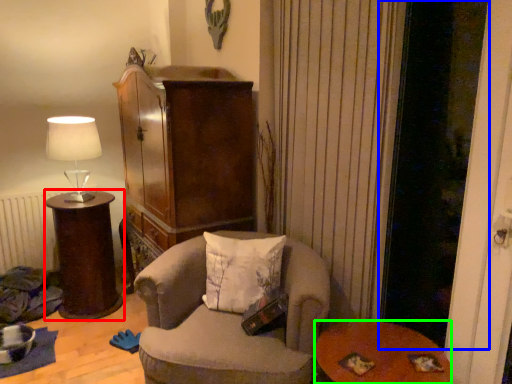
Question: Based on their relative distances, which object is farther from desk (highlighted by a red box)? Choose from screen door (highlighted by a blue box) and table (highlighted by a green box).

Choices:
 (A) screen door
 (B) table

Answer: (A)